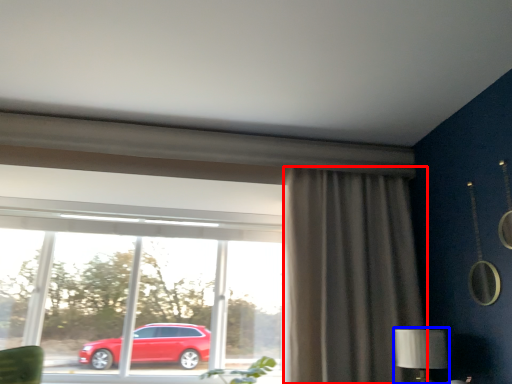
Question: Which object is closer to the camera taking this photo, curtain (highlighted by a red box) or table lamp (highlighted by a blue box)?

Choices:
 (A) curtain
 (B) table lamp

Answer: (B)